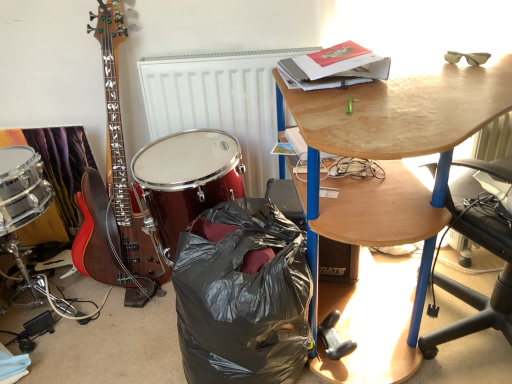
The width and height of the screenshot is (512, 384). What do you see at coordinates (219, 102) in the screenshot? I see `white textured radiator at center` at bounding box center [219, 102].

You are a GUI agent. You are given a task and a screenshot of the screen. Output one action in this format:
    pyautogui.click(x=<x>, y=<y>)
    Task: Click on the wooden desk at upper right
    The width and height of the screenshot is (512, 384).
    Given the screenshot: What is the action you would take?
    pyautogui.click(x=390, y=177)

Locate an element on the screen. Image resolution: width=512 pixels, height=384 pixels. black plastic loudspeaker at lower center is located at coordinates (338, 261).

Measure the distance between point (201, 323) and camera.

They are 3.59 feet apart.

The image size is (512, 384). I want to click on black plastic bag at lower center, so click(x=243, y=298).

The image size is (512, 384). In order to click on white textured radiator at center in this screenshot , I will do `click(219, 102)`.

From a real-world perspective, between shiny red drum at center and white textured radiator at center, who is vertically lower?

shiny red drum at center.

Is shiny red drum at center taller or shorter than white textured radiator at center?

shiny red drum at center is shorter than white textured radiator at center.

I want to click on radiator that is behind the shiny red drum at center, so click(x=219, y=102).

Considering the relative positions of shiny red drum at center and white textured radiator at center in the image provided, is shiny red drum at center behind white textured radiator at center?

No, the depth of shiny red drum at center is less than that of white textured radiator at center.

Is black plastic loudspeaker at lower center inside the boundaries of wooden desk at upper right, or outside?

black plastic loudspeaker at lower center can be found inside wooden desk at upper right.

Which object is positioned more to the right, black plastic loudspeaker at lower center or wooden desk at upper right?

wooden desk at upper right.

Locate an element on the screen. desk above the black plastic loudspeaker at lower center (from the image's perspective) is located at coordinates (390, 177).

Considering the sizes of black plastic loudspeaker at lower center and wooden desk at upper right in the image, is black plastic loudspeaker at lower center taller or shorter than wooden desk at upper right?

Considering their sizes, black plastic loudspeaker at lower center has less height than wooden desk at upper right.

Is black plastic bag at lower center at the back of shiny red drum at center?

shiny red drum at center does not have its back to black plastic bag at lower center.

Is black plastic bag at lower center a part of shiny red drum at center?

Definitely not — black plastic bag at lower center is not inside shiny red drum at center.

Which of these two, shiny red drum at center or black plastic bag at lower center, is bigger?

black plastic bag at lower center is bigger.

From the picture: Is shiny red drum at center at the right side of black plastic bag at lower center?

No.

This screenshot has height=384, width=512. Find the location of `trash bin/can that is above the black plastic loudspeaker at lower center (from a real-world perspective)`. trash bin/can that is above the black plastic loudspeaker at lower center (from a real-world perspective) is located at coordinates (243, 298).

Is black plastic loudspeaker at lower center facing towards black plastic bag at lower center?

Yes, black plastic loudspeaker at lower center is turned towards black plastic bag at lower center.

Which is in front, black plastic loudspeaker at lower center or black plastic bag at lower center?

black plastic bag at lower center is closer to the camera.

Is black plastic loudspeaker at lower center surrounding black plastic bag at lower center?

No, black plastic bag at lower center is not surrounded by black plastic loudspeaker at lower center.

From a real-world perspective, is shiny red drum at center on black plastic loudspeaker at lower center?

Indeed, from a real-world perspective, shiny red drum at center stands above black plastic loudspeaker at lower center.

Between point (191, 215) and point (327, 278), which one is positioned in front?

Point (191, 215)

Is shiny red drum at center thinner than black plastic loudspeaker at lower center?

No.

Considering the relative sizes of shiny red drum at center and black plastic loudspeaker at lower center in the image provided, is shiny red drum at center shorter than black plastic loudspeaker at lower center?

No, shiny red drum at center is not shorter than black plastic loudspeaker at lower center.

Which object is positioned more to the right, black plastic bag at lower center or shiny red drum at center?

black plastic bag at lower center.

Considering the relative sizes of black plastic bag at lower center and shiny red drum at center in the image provided, is black plastic bag at lower center bigger than shiny red drum at center?

Indeed, black plastic bag at lower center has a larger size compared to shiny red drum at center.

Between black plastic bag at lower center and shiny red drum at center, which one is positioned behind?

shiny red drum at center is further from the camera.

Between point (196, 363) and point (199, 144), which one is positioned behind?

The point (199, 144) is behind.

Are white textured radiator at center and wooden desk at upper right far apart?

No, white textured radiator at center is in close proximity to wooden desk at upper right.

Considering the points (215, 55) and (278, 119), which point is behind, point (215, 55) or point (278, 119)?

The point (278, 119) is behind.

Consider the image. Considering the positions of objects white textured radiator at center and wooden desk at upper right in the image provided, who is more to the right, white textured radiator at center or wooden desk at upper right?

wooden desk at upper right.

Can you confirm if white textured radiator at center is taller than wooden desk at upper right?

Incorrect, the height of white textured radiator at center is not larger of that of wooden desk at upper right.

In order to click on radiator behind the shiny red drum at center in this screenshot , I will do `click(219, 102)`.

This screenshot has width=512, height=384. Find the location of `desk that appears in front of the black plastic loudspeaker at lower center`. desk that appears in front of the black plastic loudspeaker at lower center is located at coordinates (390, 177).

Which object lies nearer to the anchor point black plastic bag at lower center, wooden desk at upper right or white textured radiator at center?

wooden desk at upper right lies closer to black plastic bag at lower center than the other object.

Based on their spatial positions, is shiny red drum at center or white textured radiator at center further from wooden desk at upper right?

Based on the image, white textured radiator at center appears to be further to wooden desk at upper right.

Based on their spatial positions, is black plastic bag at lower center or black plastic loudspeaker at lower center further from shiny red drum at center?

The object further to shiny red drum at center is black plastic loudspeaker at lower center.

Which object lies nearer to the anchor point wooden desk at upper right, white textured radiator at center or black plastic bag at lower center?

Based on the image, black plastic bag at lower center appears to be nearer to wooden desk at upper right.

Which object lies nearer to the anchor point black plastic loudspeaker at lower center, black plastic bag at lower center or wooden desk at upper right?

black plastic bag at lower center is positioned closer to the anchor black plastic loudspeaker at lower center.

Looking at the image, which one is located closer to black plastic bag at lower center, wooden desk at upper right or black plastic loudspeaker at lower center?

Based on the image, wooden desk at upper right appears to be nearer to black plastic bag at lower center.

When comparing their distances from black plastic loudspeaker at lower center, does shiny red drum at center or wooden desk at upper right seem closer?

Answer: shiny red drum at center lies closer to black plastic loudspeaker at lower center than the other object.

Based on their spatial positions, is white textured radiator at center or black plastic bag at lower center further from shiny red drum at center?

black plastic bag at lower center is positioned further to the anchor shiny red drum at center.

This screenshot has width=512, height=384. Find the location of `drum between black plastic bag at lower center and black plastic loudspeaker at lower center in the front-back direction`. drum between black plastic bag at lower center and black plastic loudspeaker at lower center in the front-back direction is located at coordinates (187, 179).

Where is `loudspeaker between black plastic bag at lower center and white textured radiator at center along the z-axis`? The height and width of the screenshot is (384, 512). loudspeaker between black plastic bag at lower center and white textured radiator at center along the z-axis is located at coordinates (338, 261).

Identify the location of loudspeaker located between wooden desk at upper right and white textured radiator at center in the depth direction. Image resolution: width=512 pixels, height=384 pixels. (338, 261).

I want to click on trash bin/can situated between shiny red drum at center and wooden desk at upper right from left to right, so click(243, 298).